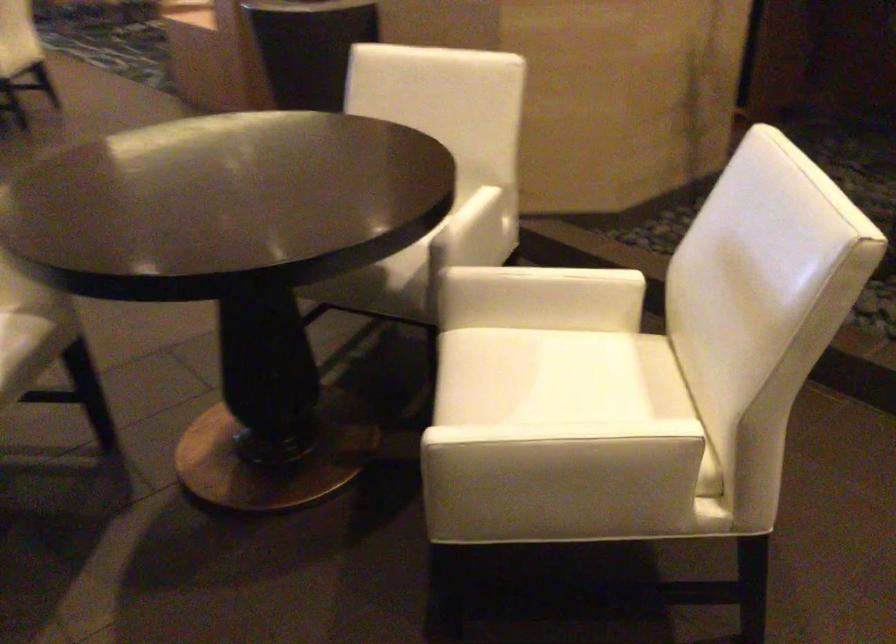
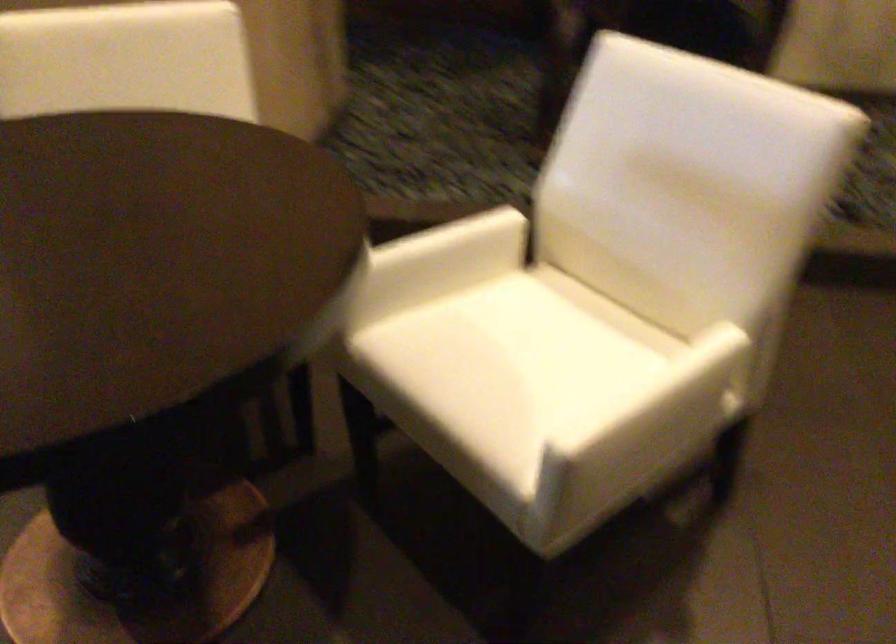
Where in the second image is the point corresponding to point (561, 391) from the first image?

(533, 348)